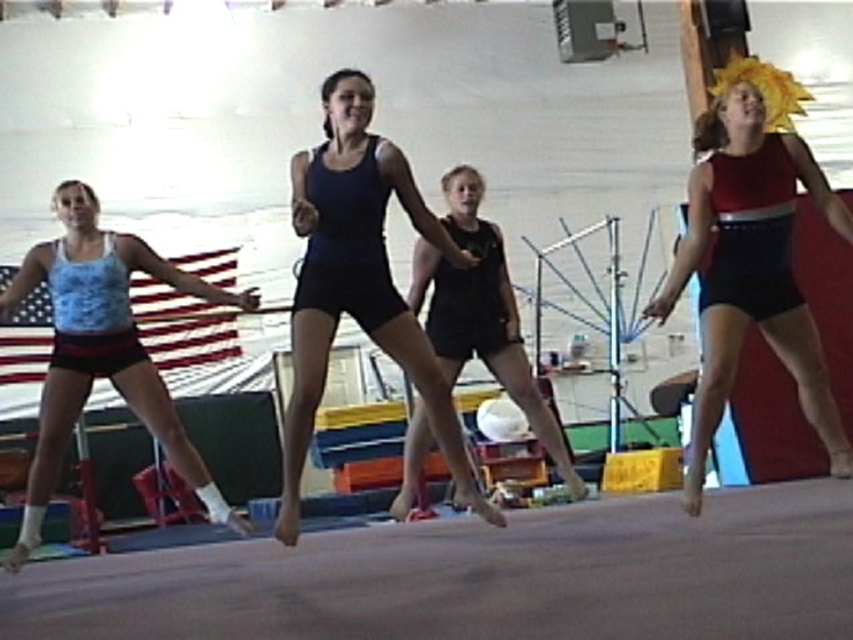
Is matte red leotard at right behind black matte shorts at center?

Result: No, matte red leotard at right is in front of black matte shorts at center.

Who is higher up, matte red leotard at right or black matte shorts at center?

Positioned higher is matte red leotard at right.

Who is more forward, (764, 125) or (410, 467)?

Point (764, 125)

You are a GUI agent. You are given a task and a screenshot of the screen. Output one action in this format:
    pyautogui.click(x=<x>, y=<y>)
    Task: Click on the matte red leotard at right
    This screenshot has width=853, height=640.
    Given the screenshot: What is the action you would take?
    pyautogui.click(x=751, y=253)

Is matte blue leotard at center shorter than blue fabric tank top at left?

No.

Between matte blue leotard at center and blue fabric tank top at left, which one has less height?

blue fabric tank top at left is shorter.

Which is in front, point (306, 339) or point (114, 276)?

Point (306, 339) is more forward.

The width and height of the screenshot is (853, 640). Identify the location of matte blue leotard at center. (358, 282).

Does matte red leotard at right have a smaller size compared to blue fabric tank top at left?

No.

Image resolution: width=853 pixels, height=640 pixels. Find the location of `matte red leotard at right`. matte red leotard at right is located at coordinates (751, 253).